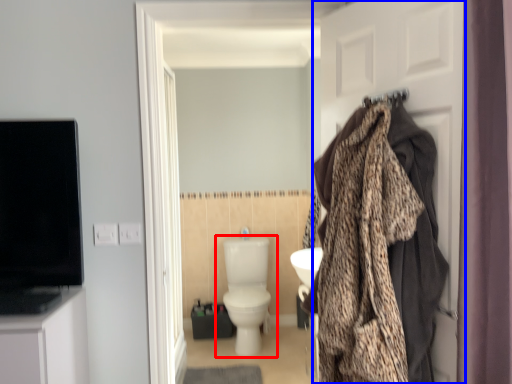
Question: Which of the following is the closest to the observer, toilet (highlighted by a red box) or door (highlighted by a blue box)?

Choices:
 (A) toilet
 (B) door

Answer: (B)